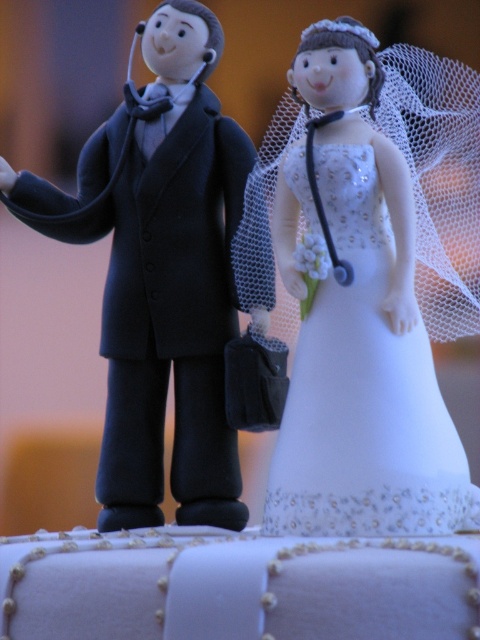
Question: Is white glossy wedding dress at upper center thinner than matte black suit at left?

Choices:
 (A) yes
 (B) no

Answer: (A)

Question: Can you confirm if white glossy wedding dress at upper center is bigger than matte black suit at left?

Choices:
 (A) no
 (B) yes

Answer: (B)

Question: Can you confirm if white glossy wedding dress at upper center is positioned to the right of matte black suit at left?

Choices:
 (A) no
 (B) yes

Answer: (B)

Question: Which of the following is the farthest from the observer?

Choices:
 (A) matte black suit at left
 (B) white glossy wedding dress at upper center

Answer: (A)